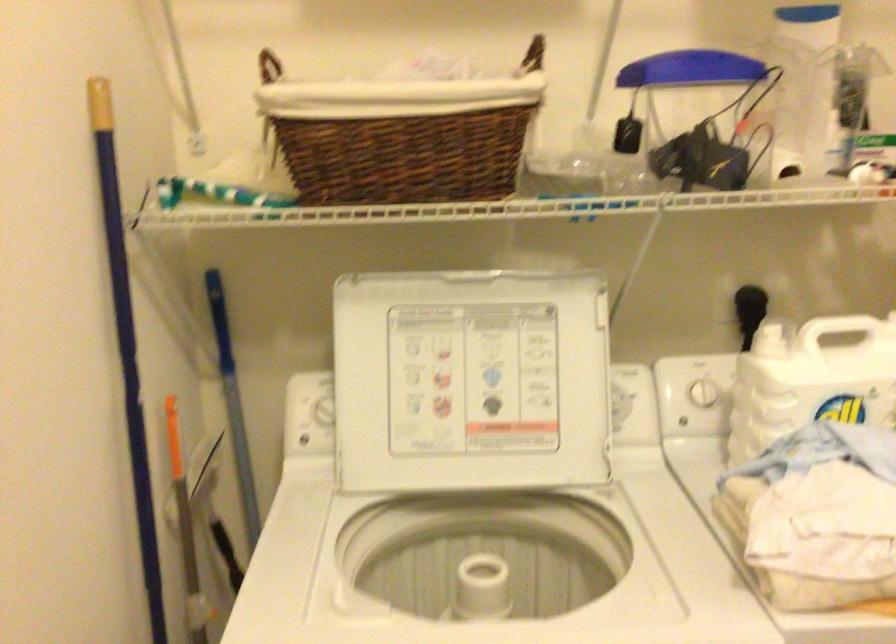
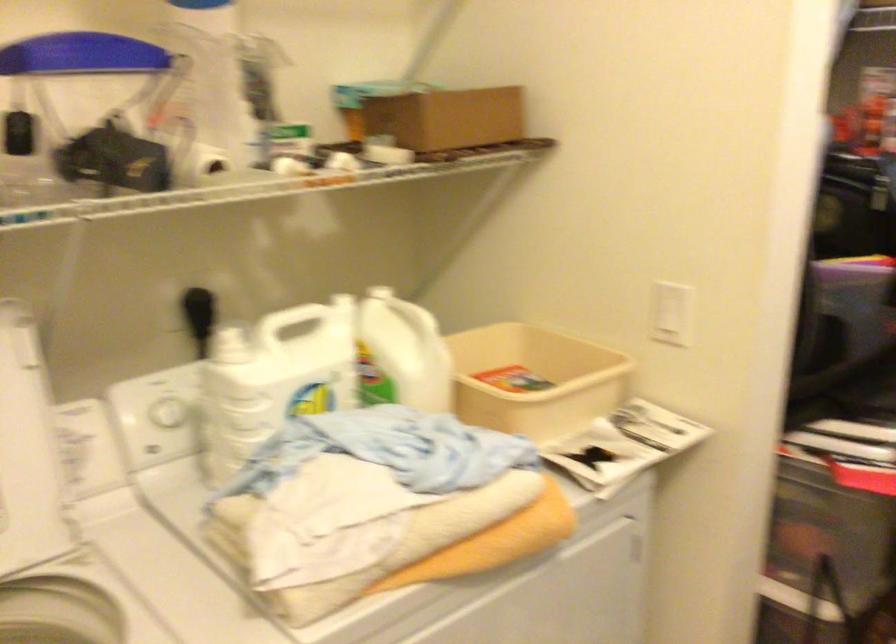
The point at (753, 303) is marked in the first image. Where is the corresponding point in the second image?

(197, 303)